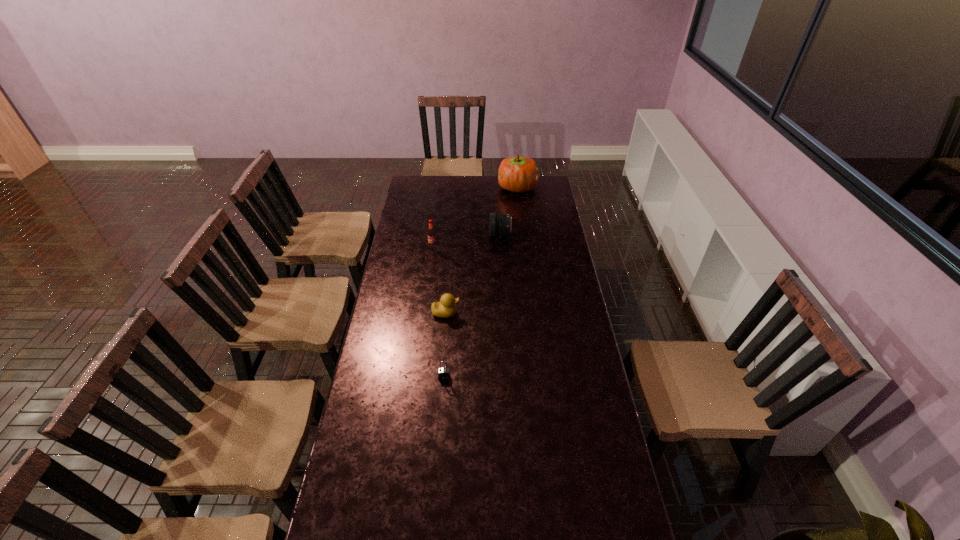
Identify the location of the tallest object. (520, 174).

This screenshot has height=540, width=960. I want to click on pumpkin, so click(x=520, y=174).

Find the location of `the leftmost object`. the leftmost object is located at coordinates (432, 235).

At what (x,y) coordinates should I click in order to perform the action: click on the second tallest object. Please return your answer as a coordinate pair (x, y). This screenshot has height=540, width=960. Looking at the image, I should click on (432, 235).

You are a GUI agent. You are given a task and a screenshot of the screen. Output one action in this format:
    pyautogui.click(x=<x>, y=<y>)
    Task: Click on the fourth nearest object
    The width and height of the screenshot is (960, 540).
    Given the screenshot: What is the action you would take?
    pyautogui.click(x=502, y=224)

At what (x,y) coordinates should I click in order to perform the action: click on the fourth farthest object. Please return your answer as a coordinate pair (x, y). This screenshot has height=540, width=960. Looking at the image, I should click on (446, 308).

At what (x,y) coordinates should I click in order to perform the action: click on padlock. Please return your answer as a coordinate pair (x, y). The width and height of the screenshot is (960, 540). Looking at the image, I should click on (443, 373).

The width and height of the screenshot is (960, 540). Find the location of `free space located on the side of the tallest object with the cute face`. free space located on the side of the tallest object with the cute face is located at coordinates (484, 187).

At what (x,y) coordinates should I click in order to perform the action: click on vacant space located 0.320m on the side of the tallest object with the cute face. Please return your answer as a coordinate pair (x, y). Looking at the image, I should click on (444, 187).

Locate an element on the screen. vacant area located on the side of the tallest object with the cute face is located at coordinates (434, 187).